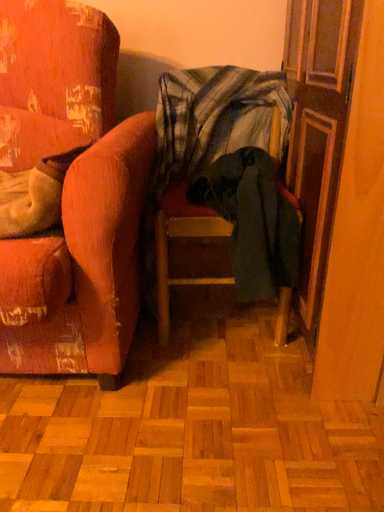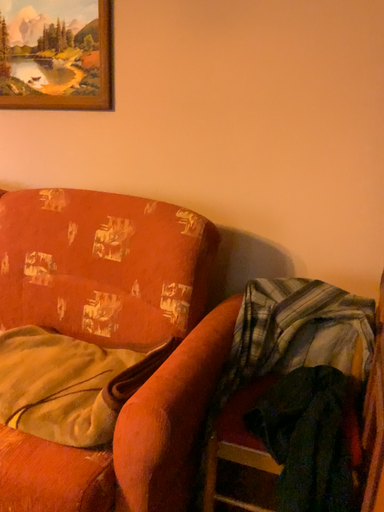
Question: How did the camera likely rotate when shooting the video?

Choices:
 (A) rotated upward
 (B) rotated downward

Answer: (A)